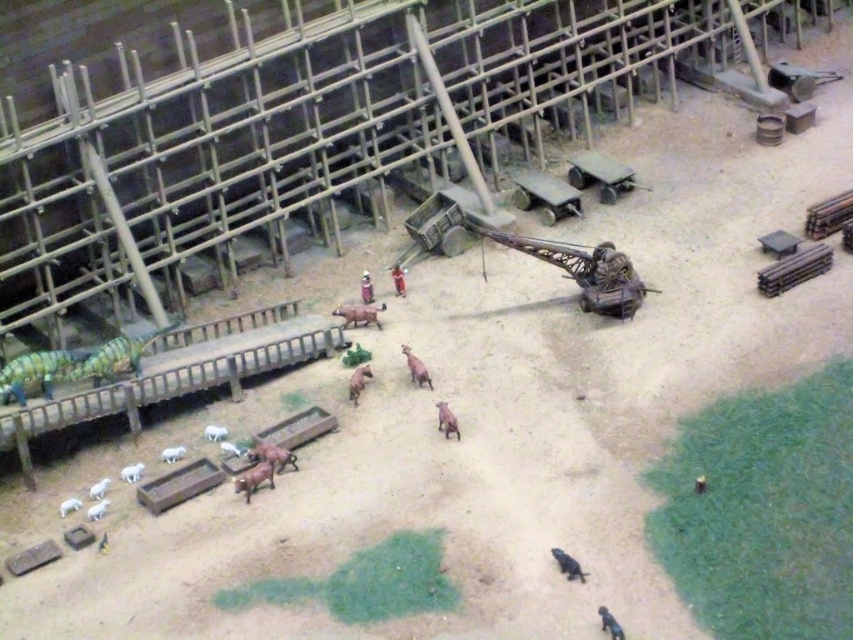
Question: Does smooth plastic figure at center appear on the right side of smooth brown figure at center?

Choices:
 (A) no
 (B) yes

Answer: (A)

Question: Which object is farther from the camera taking this photo?

Choices:
 (A) smooth plastic figure at center
 (B) smooth brown figure at center

Answer: (B)

Question: Is smooth plastic figure at center to the left of smooth brown figure at center from the viewer's perspective?

Choices:
 (A) no
 (B) yes

Answer: (B)

Question: Which object is closer to the camera taking this photo?

Choices:
 (A) smooth brown figure at center
 (B) smooth plastic figure at center

Answer: (B)

Question: Which point is farther to the camera?

Choices:
 (A) (403, 273)
 (B) (363, 282)

Answer: (A)

Question: Does smooth plastic figure at center have a greater width compared to smooth brown figure at center?

Choices:
 (A) no
 (B) yes

Answer: (B)